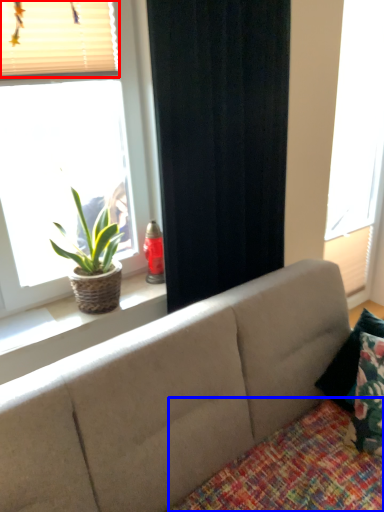
Question: Which object is further to the camera taking this photo, blind (highlighted by a red box) or quilt (highlighted by a blue box)?

Choices:
 (A) blind
 (B) quilt

Answer: (A)